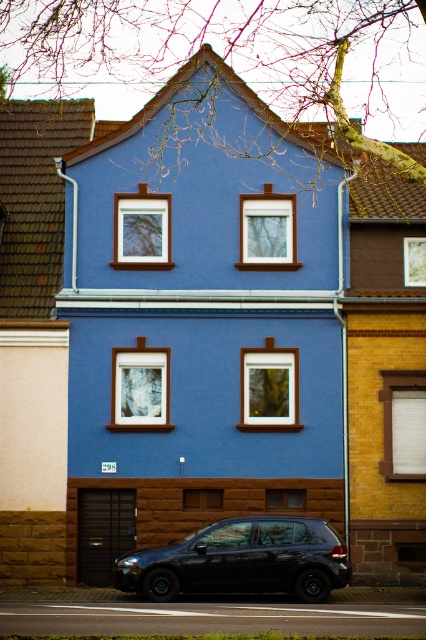
Question: Observing the image, what is the correct spatial positioning of brown wood trim at center in reference to black matte car at lower center?

Choices:
 (A) below
 (B) above

Answer: (B)

Question: Which object is farther from the camera taking this photo?

Choices:
 (A) brown wood trim at center
 (B) black matte car at lower center

Answer: (A)

Question: Which point appears farthest from the camera in this image?

Choices:
 (A) (166, 577)
 (B) (261, 344)

Answer: (B)

Question: Does brown wood trim at center have a smaller size compared to black matte car at lower center?

Choices:
 (A) yes
 (B) no

Answer: (B)

Question: Can you confirm if brown wood trim at center is thinner than black matte car at lower center?

Choices:
 (A) yes
 (B) no

Answer: (B)